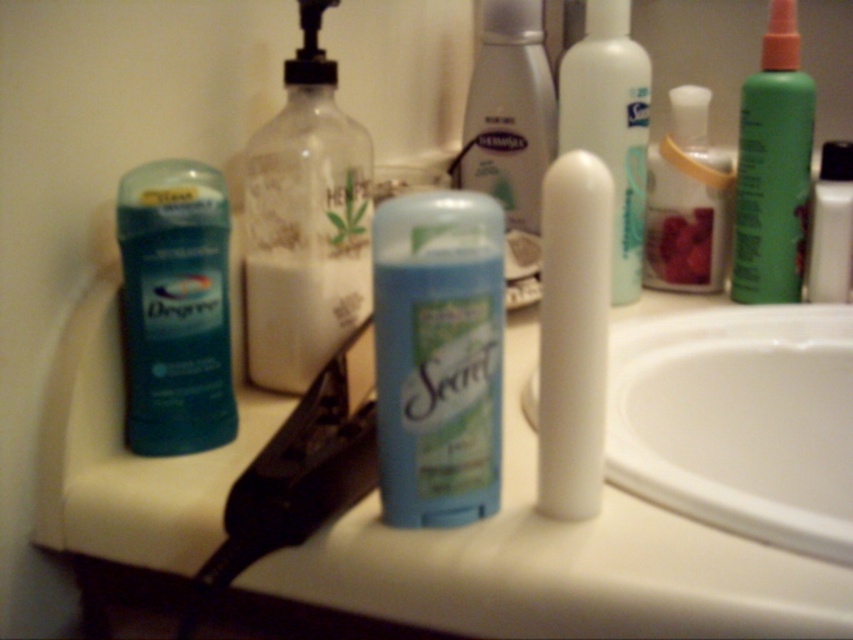
Question: Which is nearer to the translucent plastic mouthwash at center?

Choices:
 (A) white matte lotion at upper right
 (B) blue matte deodorant at center

Answer: (B)

Question: Which point is closer to the camera taking this photo?

Choices:
 (A) (669, 138)
 (B) (828, 164)
 (C) (614, 1)
 (D) (521, 138)

Answer: (C)

Question: Does blue matte deodorant at center have a lesser width compared to white glossy lotion at center?

Choices:
 (A) yes
 (B) no

Answer: (A)

Question: Is white ceramic sink at lower right to the left of green matte bottle at upper right from the viewer's perspective?

Choices:
 (A) yes
 (B) no

Answer: (A)

Question: Which is farther from the white matte lotion at center?

Choices:
 (A) translucent plastic soap dispenser at center
 (B) white glossy lotion at center
 (C) white matte lotion at upper right
 (D) teal matte deodorant at left

Answer: (D)

Question: From the image, what is the correct spatial relationship of white ceramic sink at lower right in relation to blue matte deodorant at center?

Choices:
 (A) right
 (B) left

Answer: (A)